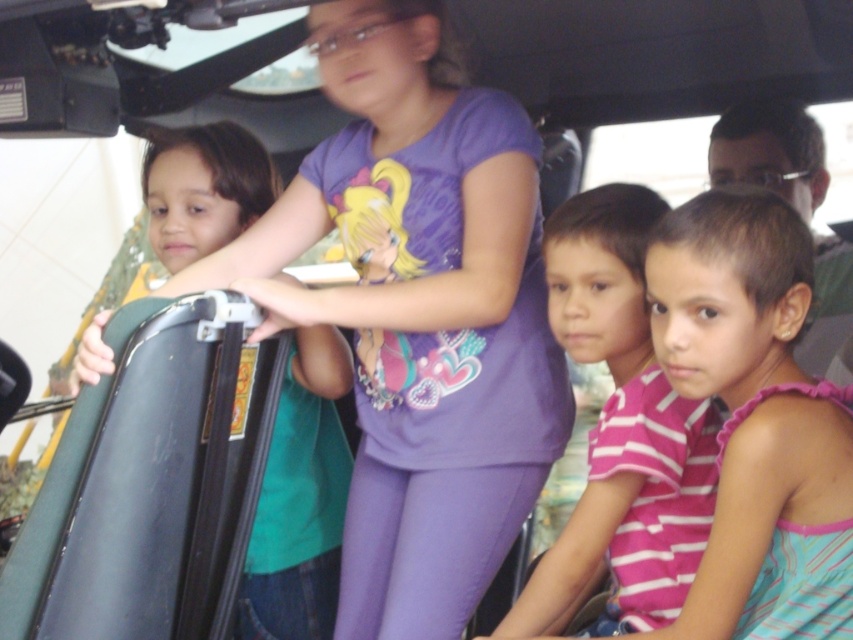
Question: Is black matte suitcase at left to the right of green matte suitcase at left from the viewer's perspective?

Choices:
 (A) yes
 (B) no

Answer: (B)

Question: Estimate the real-world distances between objects in this image. Which object is closer to the black matte suitcase at left?

Choices:
 (A) pink striped shirt at center
 (B) pink striped shirt at lower left
 (C) green matte suitcase at left

Answer: (C)

Question: Which object is positioned farthest from the pink striped shirt at lower left?

Choices:
 (A) green matte suitcase at left
 (B) black matte suitcase at left
 (C) pink striped shirt at center

Answer: (A)

Question: Which of the following is the farthest from the observer?

Choices:
 (A) (665, 333)
 (B) (202, 324)
 (C) (248, 545)

Answer: (C)

Question: Does pink striped shirt at lower left appear under pink striped shirt at center?

Choices:
 (A) yes
 (B) no

Answer: (B)

Question: Considering the relative positions of pink striped shirt at lower left and pink striped shirt at center in the image provided, where is pink striped shirt at lower left located with respect to pink striped shirt at center?

Choices:
 (A) left
 (B) right

Answer: (B)